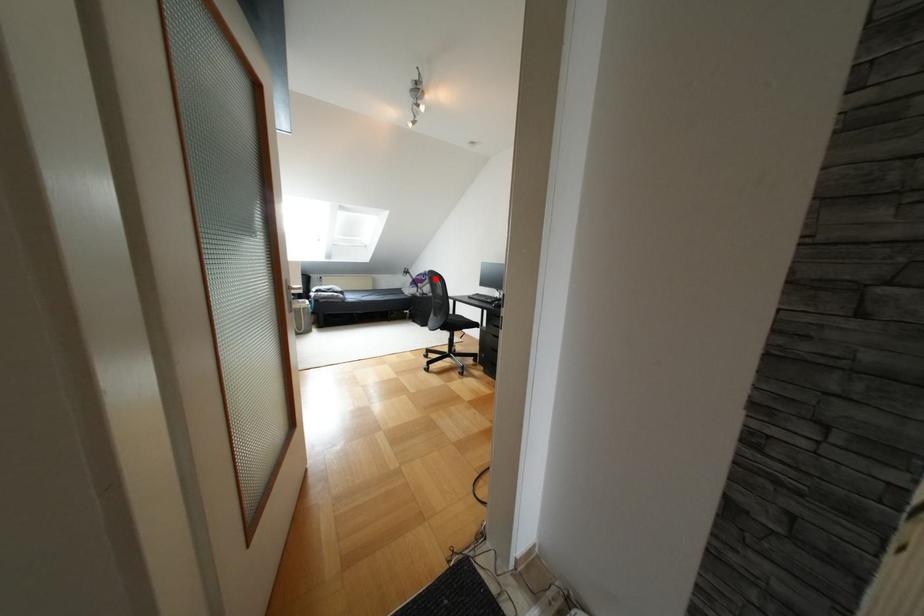
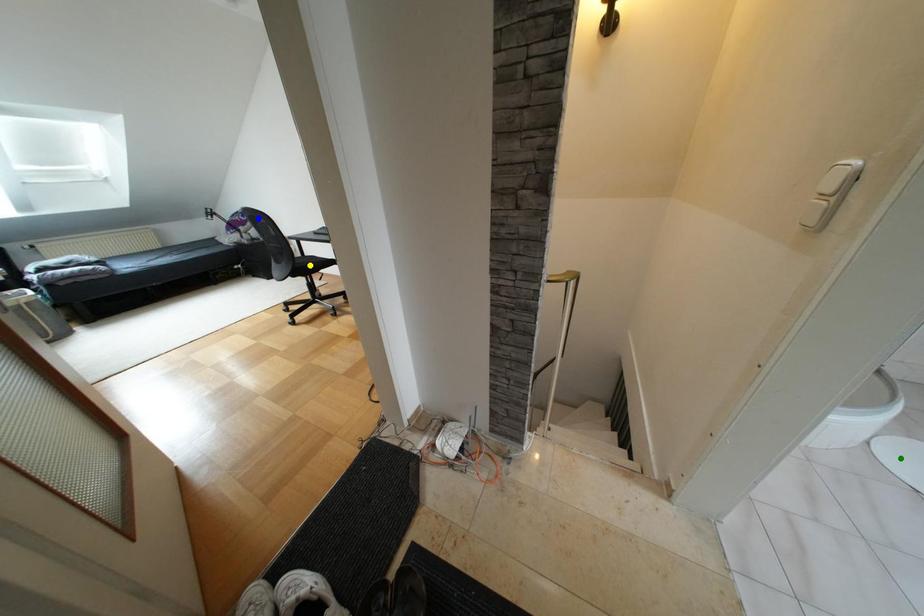
Question: I am providing you with two images of the same scene from different viewpoints. A red point is marked on the first image. You are given multiple points on the second image. Can you choose the point in image 2 that corresponds to the point in image 1?

Choices:
 (A) blue point
 (B) green point
 (C) yellow point

Answer: (A)